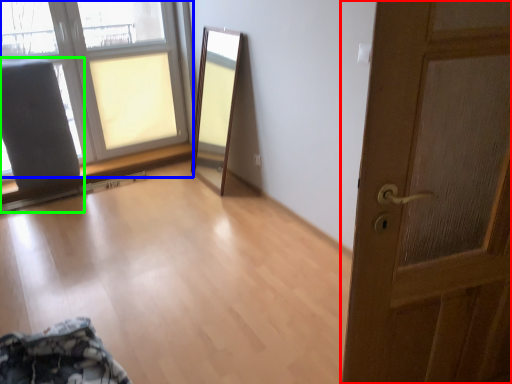
Question: Which object is positioned farthest from door (highlighted by a red box)? Select from window (highlighted by a blue box) and armchair (highlighted by a green box).

Choices:
 (A) window
 (B) armchair

Answer: (A)